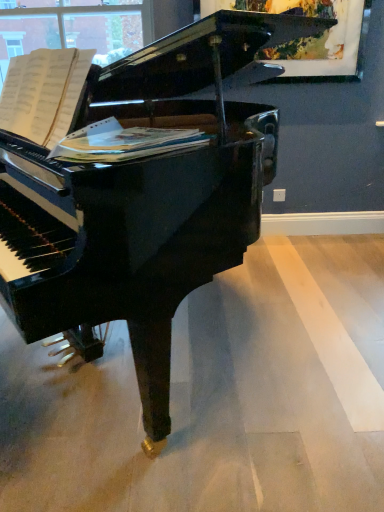
This screenshot has height=512, width=384. Describe the element at coordinates (316, 38) in the screenshot. I see `wooden picture frame at upper right` at that location.

Where is `wooden picture frame at upper right`? wooden picture frame at upper right is located at coordinates [316, 38].

Image resolution: width=384 pixels, height=512 pixels. I want to click on white paper at center, so click(x=125, y=142).

Describe the element at coordinates (125, 142) in the screenshot. I see `white paper at center` at that location.

The image size is (384, 512). I want to click on wooden picture frame at upper right, so click(x=316, y=38).

Based on their positions, is white paper at center located to the left or right of wooden picture frame at upper right?

Based on their positions, white paper at center is located to the left of wooden picture frame at upper right.

Which is in front, white paper at center or wooden picture frame at upper right?

Positioned in front is white paper at center.

Is point (152, 149) closer or farther from the camera than point (325, 38)?

Point (152, 149) is positioned closer to the camera compared to point (325, 38).

From the image's perspective, which one is positioned lower, white paper at center or wooden picture frame at upper right?

white paper at center, from the image's perspective.

From a real-world perspective, who is located higher, white paper at center or wooden picture frame at upper right?

wooden picture frame at upper right is physically above.

Looking at their sizes, would you say white paper at center is wider or thinner than wooden picture frame at upper right?

Considering their sizes, white paper at center looks broader than wooden picture frame at upper right.

Considering the relative sizes of white paper at center and wooden picture frame at upper right in the image provided, is white paper at center taller than wooden picture frame at upper right?

No.

Based on the photo, based on their sizes in the image, would you say white paper at center is bigger or smaller than wooden picture frame at upper right?

In the image, white paper at center appears to be smaller than wooden picture frame at upper right.

Is white paper at center not within wooden picture frame at upper right?

Absolutely, white paper at center is external to wooden picture frame at upper right.

Can you see white paper at center touching wooden picture frame at upper right?

white paper at center is not next to wooden picture frame at upper right, and they're not touching.

Is white paper at center aimed at wooden picture frame at upper right?

No, white paper at center is not aimed at wooden picture frame at upper right.

From the picture: What's the angular difference between white paper at center and wooden picture frame at upper right's facing directions?

The angular difference between white paper at center and wooden picture frame at upper right is 35.5 degrees.

At what (x,y) coordinates should I click in order to perform the action: click on sheet music located on the left of wooden picture frame at upper right. Please return your answer as a coordinate pair (x, y). The height and width of the screenshot is (512, 384). Looking at the image, I should click on (125, 142).

Which is more to the left, wooden picture frame at upper right or white paper at center?

Positioned to the left is white paper at center.

Is wooden picture frame at upper right in front of or behind white paper at center in the image?

wooden picture frame at upper right is behind white paper at center.

Does point (267, 58) come farther from viewer compared to point (108, 134)?

Yes.

From the image's perspective, is wooden picture frame at upper right positioned above or below white paper at center?

From the image's perspective, wooden picture frame at upper right appears above white paper at center.

From a real-world perspective, who is located lower, wooden picture frame at upper right or white paper at center?

white paper at center, from a real-world perspective.

Between wooden picture frame at upper right and white paper at center, which one has smaller width?

wooden picture frame at upper right is thinner.

Does wooden picture frame at upper right have a lesser height compared to white paper at center?

No.

Who is bigger, wooden picture frame at upper right or white paper at center?

Bigger between the two is wooden picture frame at upper right.

Would you say white paper at center is part of wooden picture frame at upper right's contents?

No, white paper at center is not inside wooden picture frame at upper right.

Is wooden picture frame at upper right in contact with white paper at center?

There is a gap between wooden picture frame at upper right and white paper at center.

Is wooden picture frame at upper right positioned with its back to white paper at center?

No.

In the image, there is a wooden picture frame at upper right. Where is `sheet music below it (from the image's perspective)`? This screenshot has width=384, height=512. sheet music below it (from the image's perspective) is located at coordinates (125, 142).

The height and width of the screenshot is (512, 384). Identify the location of sheet music in front of the wooden picture frame at upper right. 125,142.

Find the location of a particular element. This screenshot has width=384, height=512. sheet music lying below the wooden picture frame at upper right (from the image's perspective) is located at coordinates point(125,142).